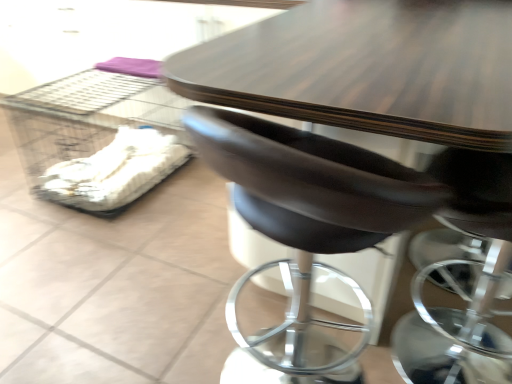
Question: Looking at their shapes, would you say clear plastic crate at left is wider or thinner than brown leather chair at center?

Choices:
 (A) wide
 (B) thin

Answer: (A)

Question: In the image, is clear plastic crate at left on the left side or the right side of brown leather chair at center?

Choices:
 (A) left
 (B) right

Answer: (A)

Question: From their relative heights in the image, would you say clear plastic crate at left is taller or shorter than brown leather chair at center?

Choices:
 (A) short
 (B) tall

Answer: (A)

Question: Based on their positions, is brown leather chair at center located to the left or right of clear plastic crate at left?

Choices:
 (A) right
 (B) left

Answer: (A)

Question: Is brown leather chair at center situated inside clear plastic crate at left or outside?

Choices:
 (A) outside
 (B) inside

Answer: (A)

Question: From a real-world perspective, is brown leather chair at center positioned above or below clear plastic crate at left?

Choices:
 (A) below
 (B) above

Answer: (B)

Question: In terms of height, does brown leather chair at center look taller or shorter compared to clear plastic crate at left?

Choices:
 (A) short
 (B) tall

Answer: (B)